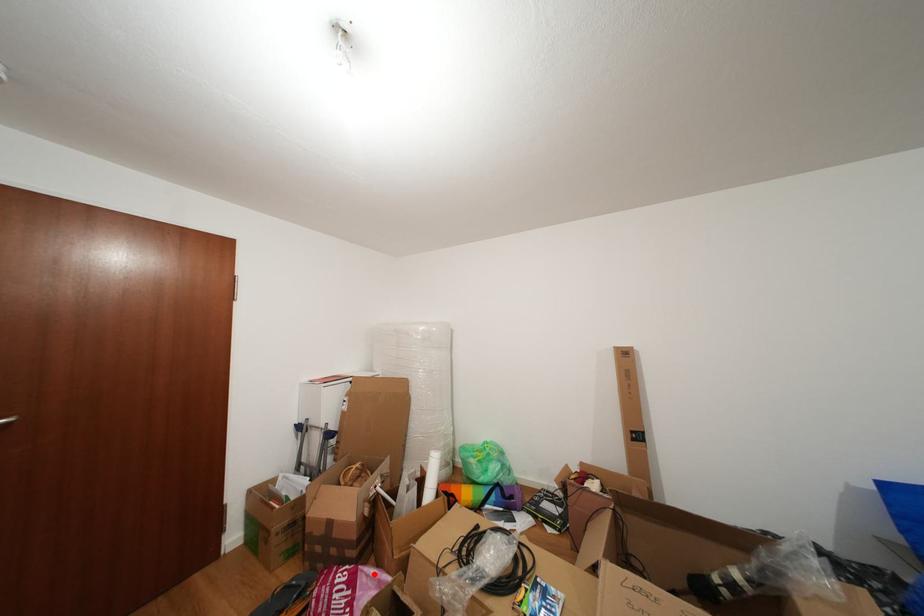
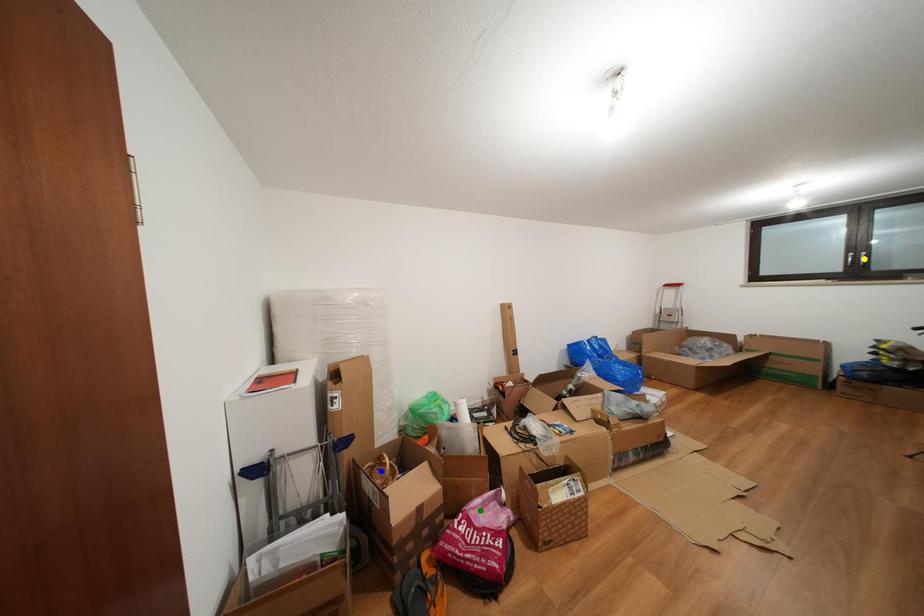
Question: I am providing you with two images of the same scene from different viewpoints. A red point is marked on the first image. You are given multiple points on the second image. Can you choose the point in image 2 that corresponds to the point in image 1?

Choices:
 (A) green point
 (B) blue point
 (C) yellow point

Answer: (A)